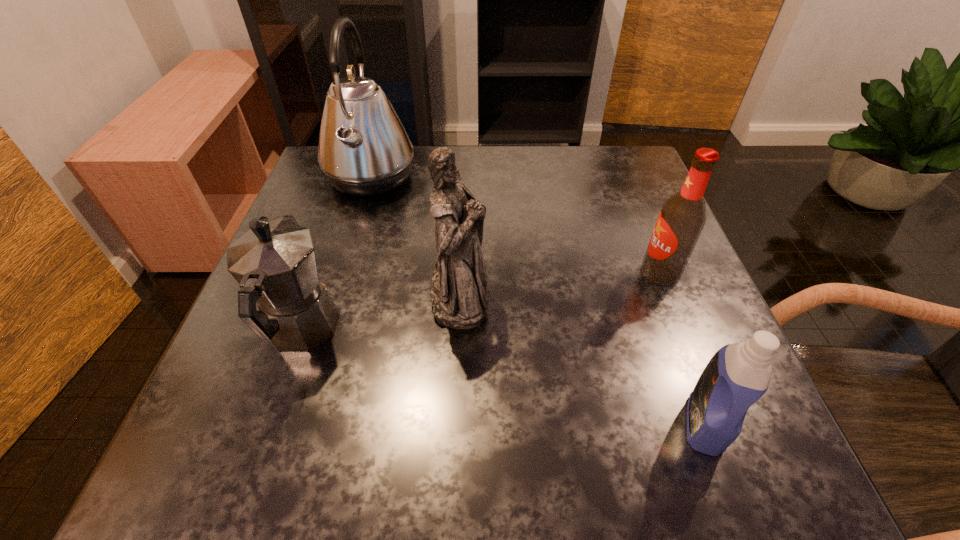
Where is `kettle`? This screenshot has width=960, height=540. kettle is located at coordinates (x=364, y=150).

In order to click on the farthest object in this screenshot , I will do coord(364,150).

This screenshot has width=960, height=540. Find the location of `figurine`. figurine is located at coordinates (459, 298).

Locate an element on the screen. beer bottle is located at coordinates (682, 217).

Where is `coffeepot`? coffeepot is located at coordinates (274, 262).

In order to click on detergent in this screenshot , I will do `click(738, 374)`.

This screenshot has width=960, height=540. Find the location of `free space located from the spout of the tallest object`. free space located from the spout of the tallest object is located at coordinates (515, 178).

Locate an element on the screen. The height and width of the screenshot is (540, 960). vacant space situated 0.140m on the front-facing side of the figurine is located at coordinates (565, 296).

The width and height of the screenshot is (960, 540). I want to click on free location located 0.220m on the back of the beer bottle, so click(629, 193).

Locate an element on the screen. free spot located on the pouring side of the coffeepot is located at coordinates pos(349,192).